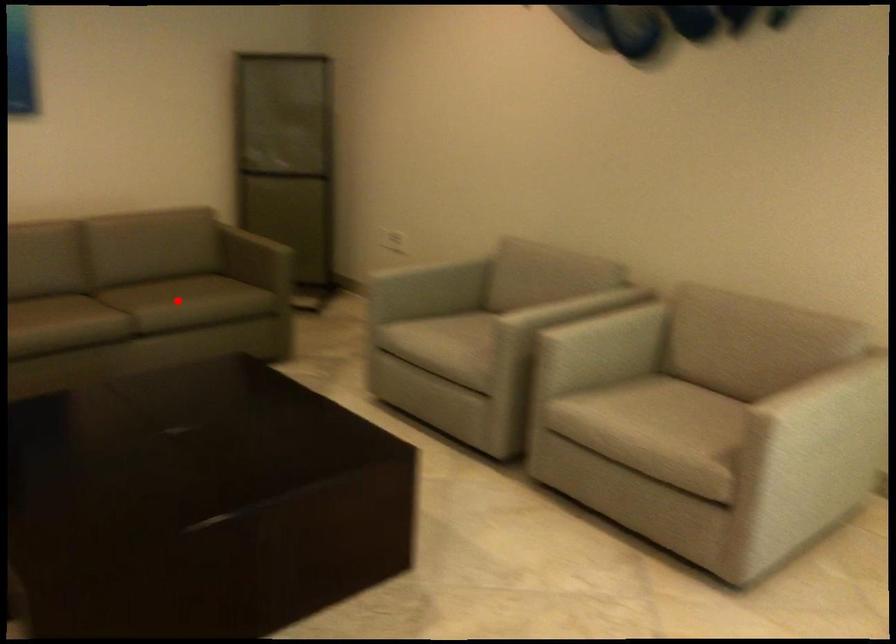
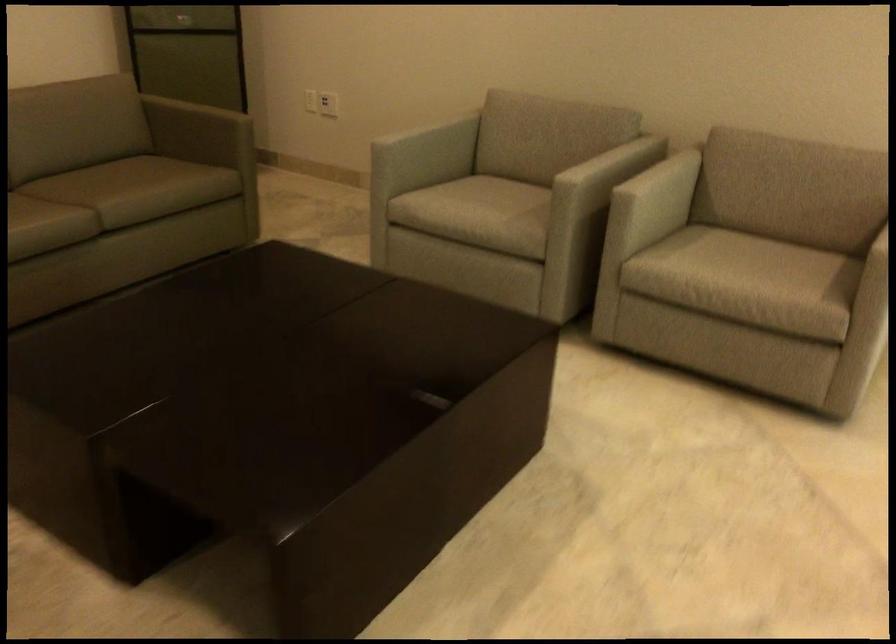
Find the pixel in the second image that matches the highlighted location in the first image.

(145, 187)